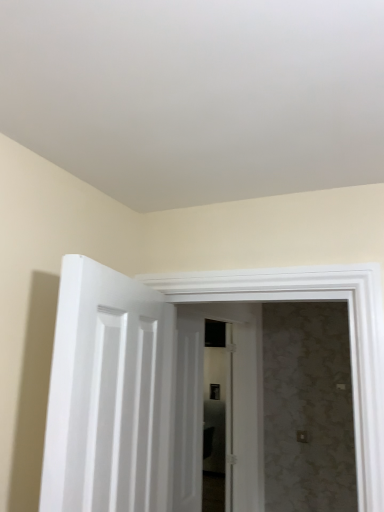
Question: From a real-world perspective, is white wooden door at center, the first door positioned from the back, physically located above or below white painted wood door at left, positioned as the 1th door in front-to-back order?

Choices:
 (A) below
 (B) above

Answer: (A)

Question: In terms of size, does white wooden door at center, the first door positioned from the back, appear bigger or smaller than white painted wood door at left, positioned as the 1th door in front-to-back order?

Choices:
 (A) big
 (B) small

Answer: (A)

Question: Considering the positions of white wooden door at center, marked as the 2th door in a front-to-back arrangement, and white painted wood door at left, positioned as the 1th door in front-to-back order, in the image, is white wooden door at center, marked as the 2th door in a front-to-back arrangement, taller or shorter than white painted wood door at left, positioned as the 1th door in front-to-back order,?

Choices:
 (A) short
 (B) tall

Answer: (B)

Question: Considering the positions of point (72, 339) and point (236, 305), is point (72, 339) closer or farther from the camera than point (236, 305)?

Choices:
 (A) farther
 (B) closer

Answer: (B)

Question: From their relative heights in the image, would you say white painted wood door at left, which is the 2th door in back-to-front order, is taller or shorter than white wooden door at center, the first door positioned from the back?

Choices:
 (A) tall
 (B) short

Answer: (B)

Question: Is white painted wood door at left, which is the 2th door in back-to-front order, inside or outside of white wooden door at center, marked as the 2th door in a front-to-back arrangement?

Choices:
 (A) outside
 (B) inside

Answer: (A)

Question: In the image, is white painted wood door at left, which is the 2th door in back-to-front order, positioned in front of or behind white wooden door at center, the first door positioned from the back?

Choices:
 (A) behind
 (B) front

Answer: (B)